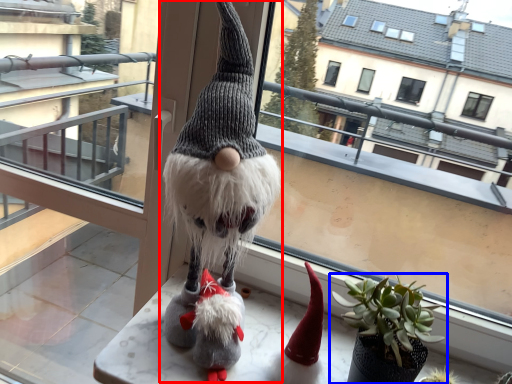
Question: Which object appears farthest to the camera in this image, figurine (highlighted by a red box) or houseplant (highlighted by a blue box)?

Choices:
 (A) figurine
 (B) houseplant

Answer: (B)